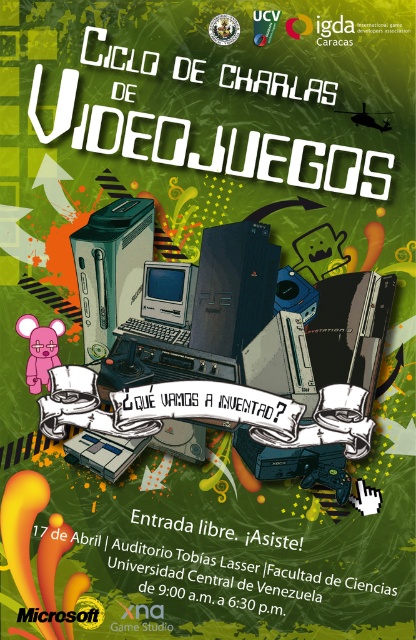
Does satin black playstation at center appear under green matte xbox at center?

Yes, satin black playstation at center is below green matte xbox at center.

Based on the photo, can you confirm if satin black playstation at center is thinner than green matte xbox at center?

In fact, satin black playstation at center might be wider than green matte xbox at center.

Is point (262, 253) positioned after point (140, 230)?

No, it is not.

Locate an element on the screen. Image resolution: width=416 pixels, height=640 pixels. satin black playstation at center is located at coordinates (233, 285).

Who is positioned more to the right, matte gray computer at center or pink rubber mouse at lower left?

From the viewer's perspective, matte gray computer at center appears more on the right side.

Can you confirm if matte gray computer at center is positioned to the right of pink rubber mouse at lower left?

Yes, matte gray computer at center is to the right of pink rubber mouse at lower left.

Is point (175, 337) positioned behind point (52, 356)?

Yes, it is behind point (52, 356).

Locate an element on the screen. This screenshot has height=640, width=416. matte gray computer at center is located at coordinates (165, 301).

Can you confirm if green matte xbox at center is thinner than pink rubber mouse at lower left?

Incorrect, green matte xbox at center's width is not less than pink rubber mouse at lower left's.

Does green matte xbox at center have a larger size compared to pink rubber mouse at lower left?

Indeed, green matte xbox at center has a larger size compared to pink rubber mouse at lower left.

Who is more distant from viewer, (91, 291) or (31, 381)?

Positioned behind is point (91, 291).

The image size is (416, 640). I want to click on green matte xbox at center, so click(111, 268).